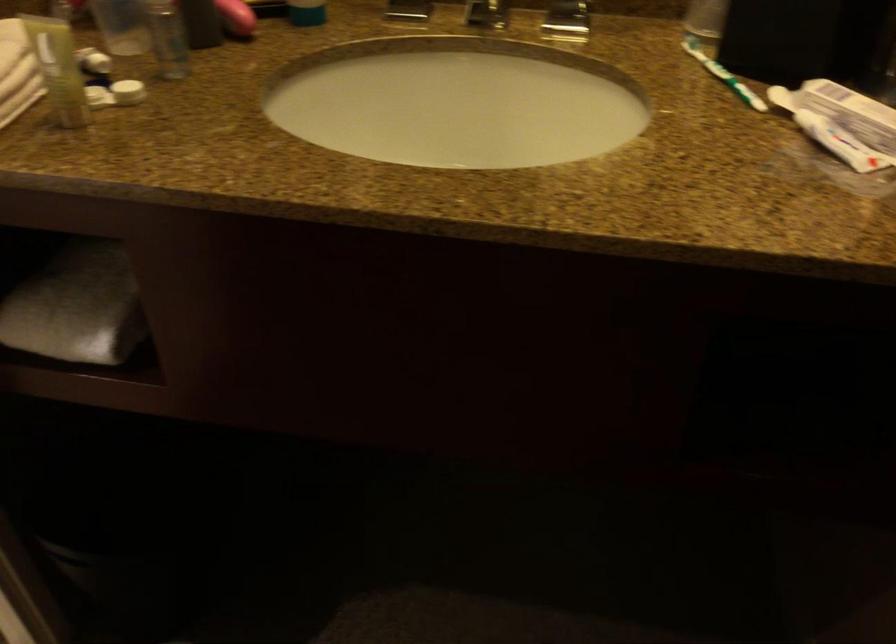
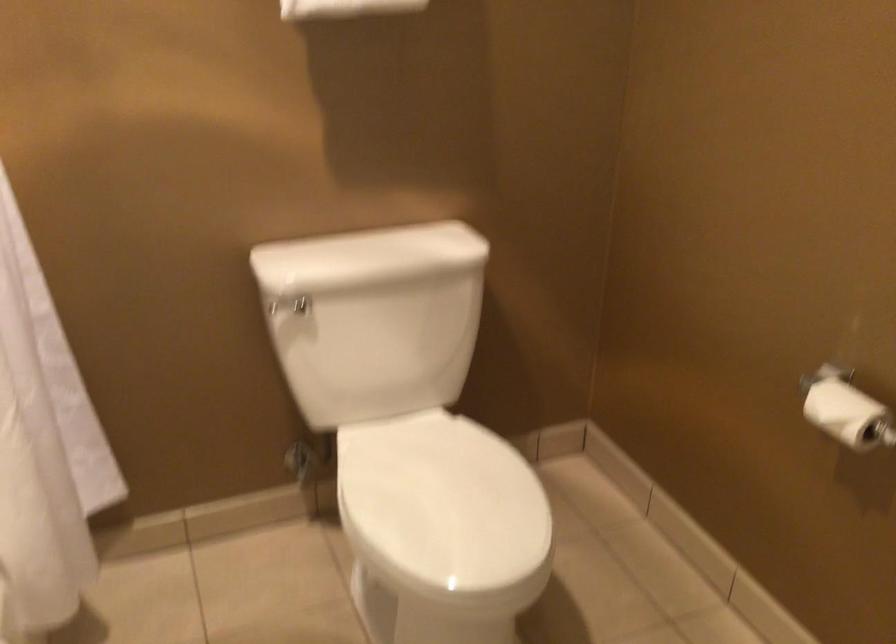
Question: The camera is either moving clockwise (left) or counter-clockwise (right) around the object. The first image is from the beginning of the video and the second image is from the end. Is the camera moving left or right when shooting the video?

Choices:
 (A) Left
 (B) Right

Answer: (B)